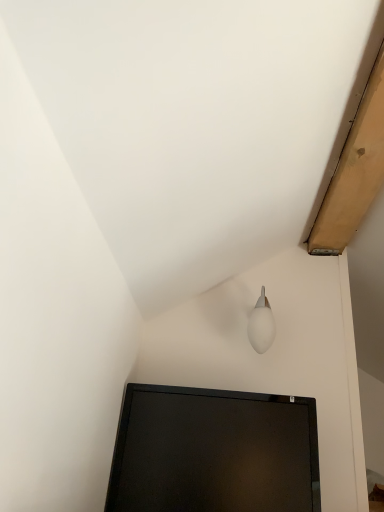
Question: Should I look upward or downward to see white frosted glass lamp at upper right?

Choices:
 (A) up
 (B) down

Answer: (B)

Question: Is the position of black glossy monitor at lower center less distant than that of white frosted glass lamp at upper right?

Choices:
 (A) no
 (B) yes

Answer: (B)

Question: Can you confirm if black glossy monitor at lower center is bigger than white frosted glass lamp at upper right?

Choices:
 (A) no
 (B) yes

Answer: (B)

Question: Is white frosted glass lamp at upper right inside black glossy monitor at lower center?

Choices:
 (A) no
 (B) yes

Answer: (A)

Question: Is black glossy monitor at lower center at the right side of white frosted glass lamp at upper right?

Choices:
 (A) yes
 (B) no

Answer: (B)

Question: Is black glossy monitor at lower center wider than white frosted glass lamp at upper right?

Choices:
 (A) yes
 (B) no

Answer: (A)

Question: Can you confirm if black glossy monitor at lower center is thinner than white frosted glass lamp at upper right?

Choices:
 (A) no
 (B) yes

Answer: (A)

Question: From a real-world perspective, is white frosted glass lamp at upper right under black glossy monitor at lower center?

Choices:
 (A) yes
 (B) no

Answer: (B)

Question: Considering the relative sizes of white frosted glass lamp at upper right and black glossy monitor at lower center in the image provided, is white frosted glass lamp at upper right thinner than black glossy monitor at lower center?

Choices:
 (A) yes
 (B) no

Answer: (A)

Question: Does white frosted glass lamp at upper right come behind black glossy monitor at lower center?

Choices:
 (A) no
 (B) yes

Answer: (B)

Question: From the image's perspective, would you say white frosted glass lamp at upper right is positioned over black glossy monitor at lower center?

Choices:
 (A) no
 (B) yes

Answer: (B)

Question: From a real-world perspective, is white frosted glass lamp at upper right on top of black glossy monitor at lower center?

Choices:
 (A) yes
 (B) no

Answer: (A)

Question: Are white frosted glass lamp at upper right and black glossy monitor at lower center far apart?

Choices:
 (A) no
 (B) yes

Answer: (A)

Question: Considering the positions of white frosted glass lamp at upper right and black glossy monitor at lower center in the image, is white frosted glass lamp at upper right taller or shorter than black glossy monitor at lower center?

Choices:
 (A) tall
 (B) short

Answer: (B)